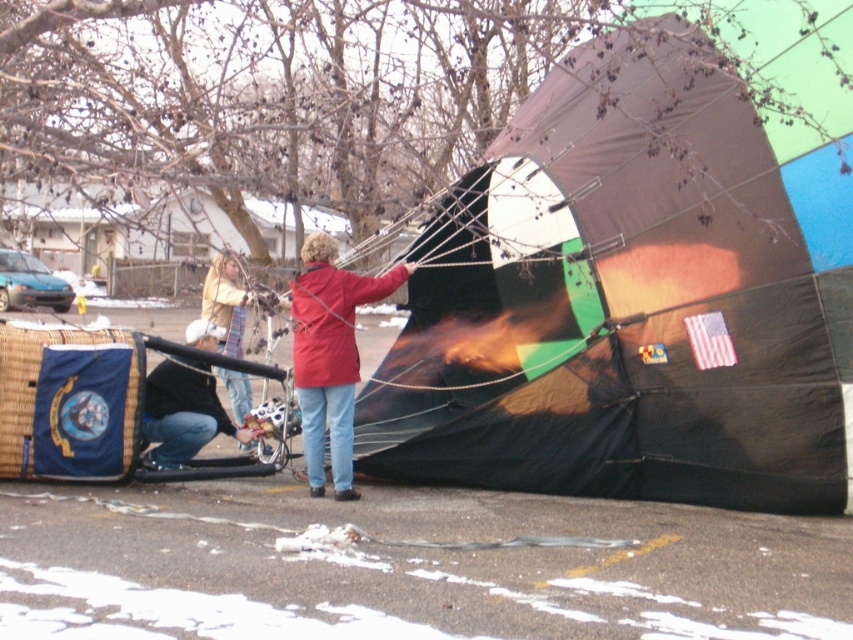
Question: Which point is farther to the camera?

Choices:
 (A) [x=811, y=58]
 (B) [x=196, y=324]

Answer: (B)

Question: Does black matte parachute at center have a larger size compared to red matte jacket at center?

Choices:
 (A) no
 (B) yes

Answer: (B)

Question: Does denim jeans at lower left have a larger size compared to striped scarf at center?

Choices:
 (A) yes
 (B) no

Answer: (B)

Question: Which object is closer to the camera taking this photo?

Choices:
 (A) red matte jacket at center
 (B) denim jeans at lower left

Answer: (A)

Question: From the image, what is the correct spatial relationship of black matte parachute at center in relation to red matte jacket at center?

Choices:
 (A) left
 (B) right

Answer: (B)

Question: Which of the following is the farthest from the observer?

Choices:
 (A) black matte parachute at center
 (B) red matte jacket at center
 (C) denim jeans at lower left
 (D) striped scarf at center

Answer: (D)